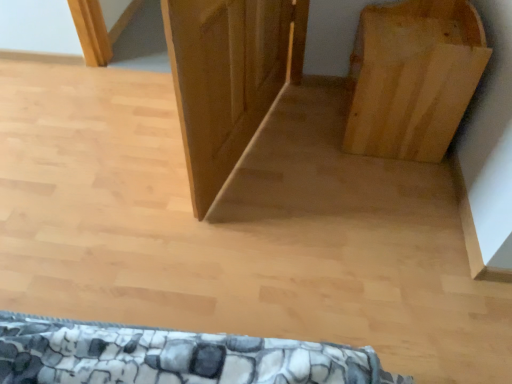
This screenshot has height=384, width=512. What are the coordinates of `free location to the left of natural wood bookshelf at right` in the screenshot? It's located at (311, 129).